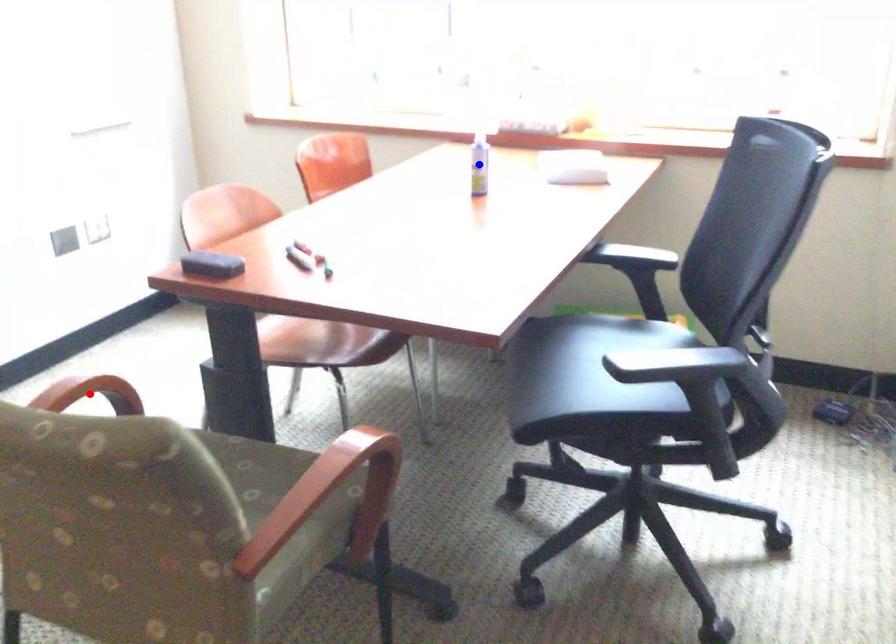
Question: In the image, two points are highlighted. Which point is nearer to the camera? Reply with the corresponding letter.

Choices:
 (A) blue point
 (B) red point

Answer: (B)